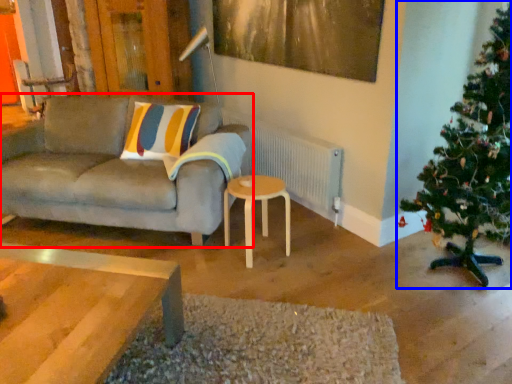
Question: Among these objects, which one is farthest to the camera, studio couch (highlighted by a red box) or christmas tree (highlighted by a blue box)?

Choices:
 (A) studio couch
 (B) christmas tree

Answer: (A)